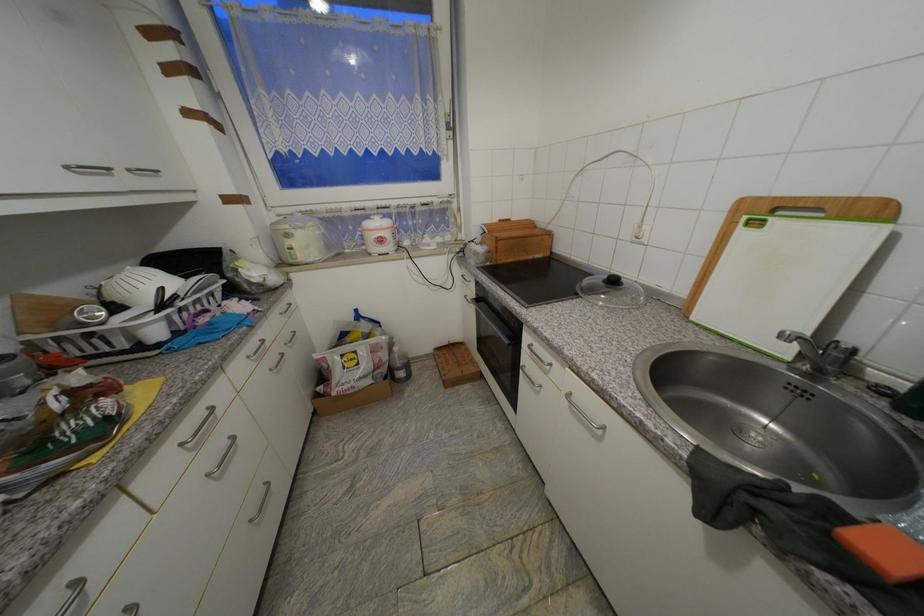
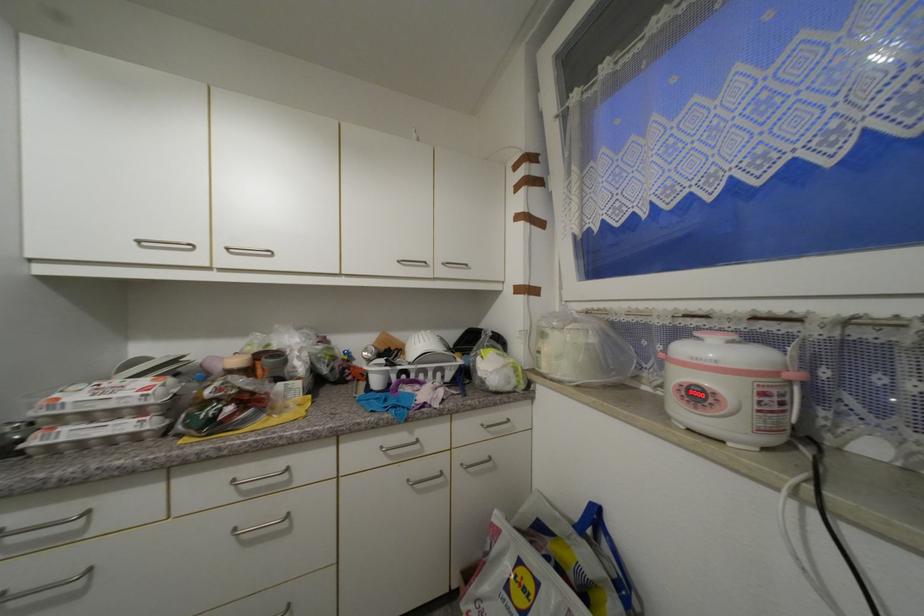
Find the pixel in the second image that matches point 135,172 in the first image.

(448, 265)